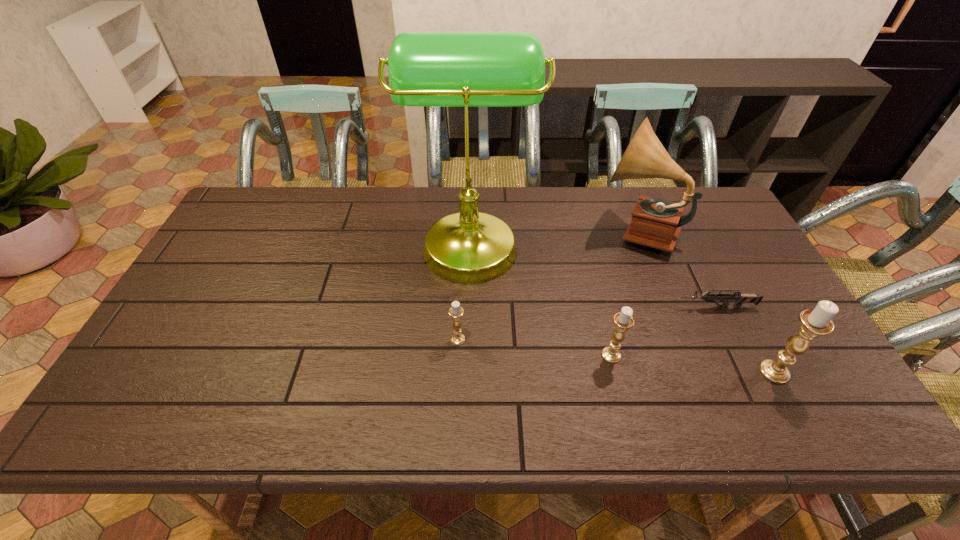
You are a GUI agent. You are given a task and a screenshot of the screen. Output one action in this format:
    pyautogui.click(x=<x>, y=<y>)
    Task: Click on the lamp that is at the far edge
    This screenshot has height=540, width=960.
    Given the screenshot: What is the action you would take?
    pyautogui.click(x=466, y=69)

Identify the location of phonograph record situated at the far edge. (656, 223).

You are a GUI agent. You are given a task and a screenshot of the screen. Output one action in this format:
    pyautogui.click(x=<x>, y=<y>)
    Task: Click on the candle holder that is at the right edge
    The image size is (960, 540).
    Given the screenshot: What is the action you would take?
    pyautogui.click(x=815, y=322)

In order to click on gun positioned at the right edge in this screenshot , I will do `click(739, 298)`.

Image resolution: width=960 pixels, height=540 pixels. Identify the location of object located in the near right corner section of the desktop. (815, 322).

Identify the location of free space at the far edge of the desktop. The width and height of the screenshot is (960, 540). (651, 192).

Where is `vacant space at the near edge`? Image resolution: width=960 pixels, height=540 pixels. vacant space at the near edge is located at coordinates (548, 376).

Where is `vacant space at the left edge of the desktop`? The image size is (960, 540). vacant space at the left edge of the desktop is located at coordinates (228, 279).

In the image, there is a desktop. Identify the location of vacant space at the far left corner. (281, 199).

This screenshot has height=540, width=960. Identify the location of vacant region at the far right corner of the desktop. (712, 188).